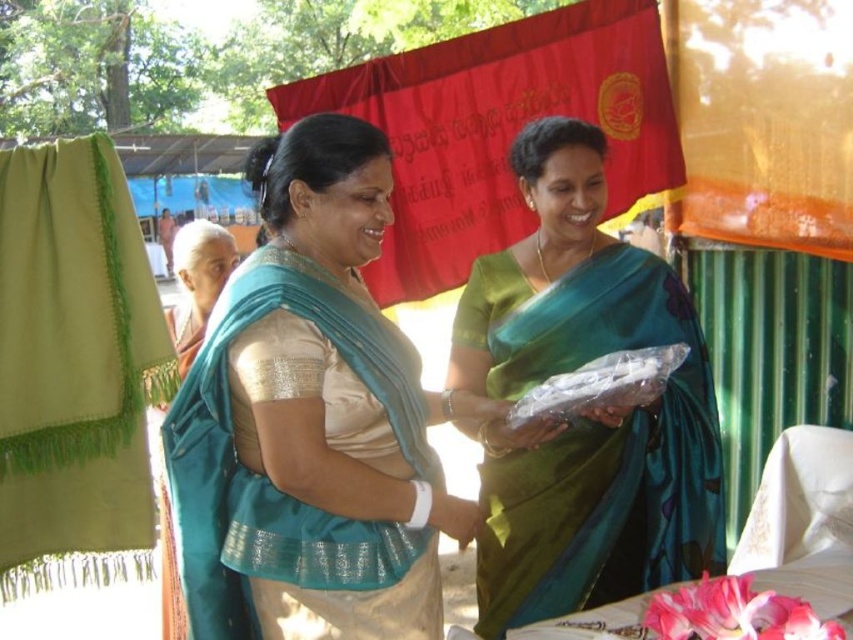
Question: Which object is positioned farthest from the red fabric canopy at upper center?

Choices:
 (A) green fabric at left
 (B) translucent plastic food at center

Answer: (B)

Question: Which object appears closest to the camera in this image?

Choices:
 (A) white embroidered tablecloth at lower right
 (B) green silk saree at center
 (C) translucent plastic food at center

Answer: (A)

Question: Can you confirm if teal silk saree at center is positioned to the right of white embroidered tablecloth at lower right?

Choices:
 (A) yes
 (B) no

Answer: (B)

Question: Which point appears farthest from the camera in this image?

Choices:
 (A) (809, 556)
 (B) (219, 490)
 (C) (64, 451)

Answer: (C)

Question: Does teal silk saree at center appear on the right side of red fabric canopy at upper center?

Choices:
 (A) no
 (B) yes

Answer: (A)

Question: Considering the relative positions of teal silk saree at center and white embroidered tablecloth at lower right in the image provided, where is teal silk saree at center located with respect to white embroidered tablecloth at lower right?

Choices:
 (A) left
 (B) right

Answer: (A)